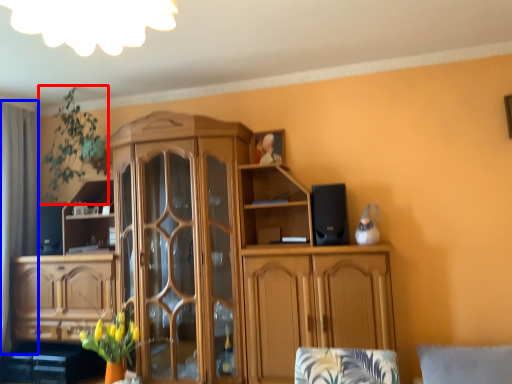
Question: Which object appears farthest to the camera in this image, plant (highlighted by a red box) or curtain (highlighted by a blue box)?

Choices:
 (A) plant
 (B) curtain

Answer: (B)